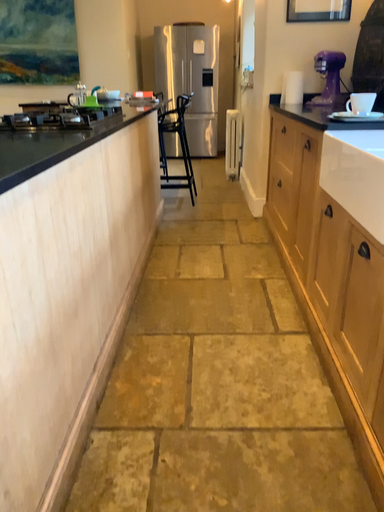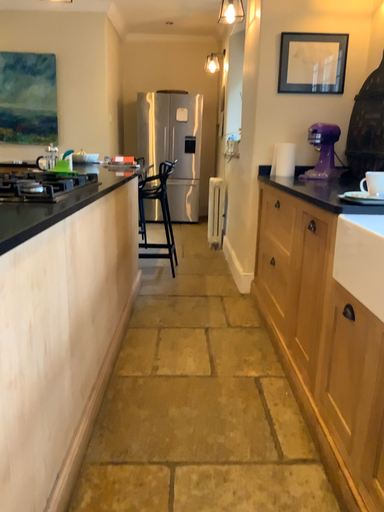
Question: Which way did the camera rotate in the video?

Choices:
 (A) rotated downward
 (B) rotated upward

Answer: (B)